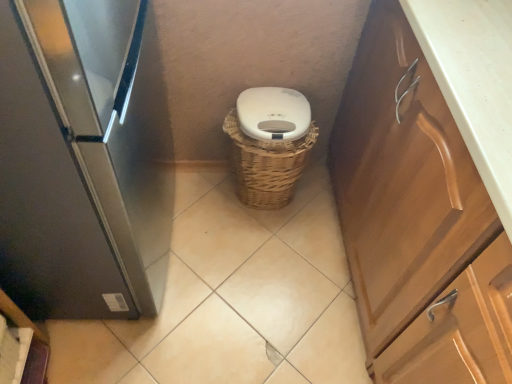
Locate an element on the screen. free region on the left part of woven brown basket at center is located at coordinates (195, 201).